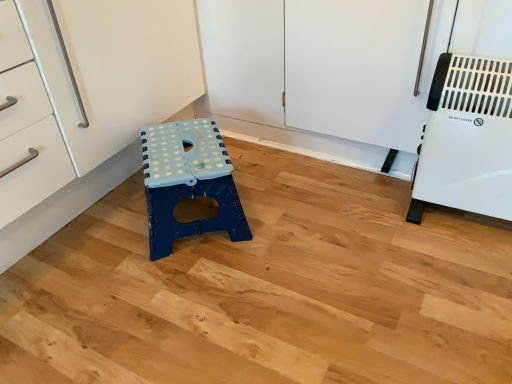
This screenshot has height=384, width=512. Identify the location of blank space situated above blue plastic stool at center (from a real-world perspective). (184, 159).